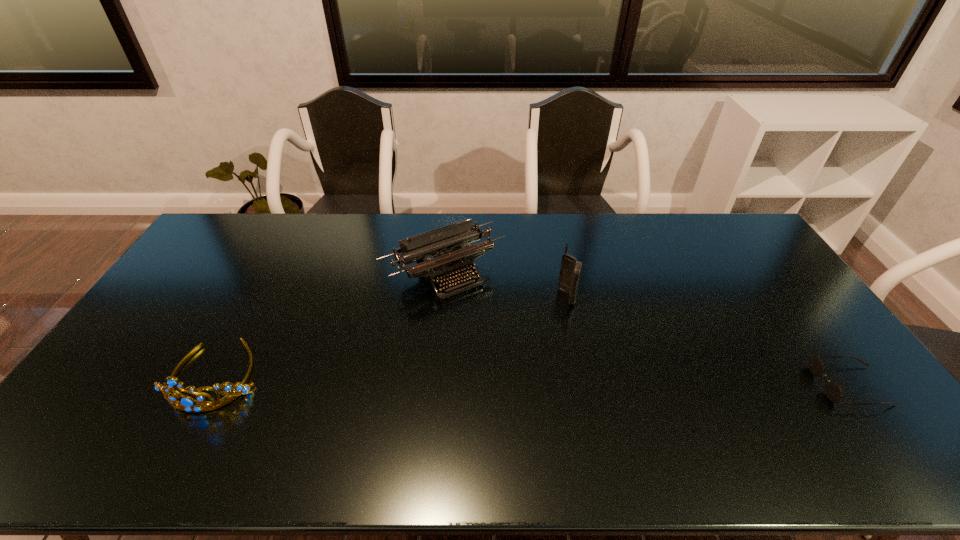
Identify the location of vacant area at the far edge of the desktop. (408, 222).

Where is `vacant space at the near edge of the desktop`? This screenshot has height=540, width=960. vacant space at the near edge of the desktop is located at coordinates (473, 423).

Find the location of `free region at the left edge of the desktop`. free region at the left edge of the desktop is located at coordinates (166, 290).

Locate an element on the screen. The image size is (960, 540). vacant position at the right edge of the desktop is located at coordinates (780, 274).

I want to click on vacant space at the far left corner of the desktop, so click(229, 225).

At what (x,y) coordinates should I click in order to perform the action: click on vacant region between the third object from left to right and the tiara. Please return your answer as a coordinate pair (x, y). Looking at the image, I should click on 392,335.

Where is `free point between the typewriter and the tiara`? free point between the typewriter and the tiara is located at coordinates (330, 323).

The image size is (960, 540). Find the location of `vacant space that's between the second object from right to left and the typewriter`. vacant space that's between the second object from right to left and the typewriter is located at coordinates (506, 284).

Find the location of a particular element. The image size is (960, 540). free spot between the shortest object and the leftmost object is located at coordinates (533, 380).

Find the location of a particular element. vacant region between the leftmost object and the sunglasses is located at coordinates (533, 380).